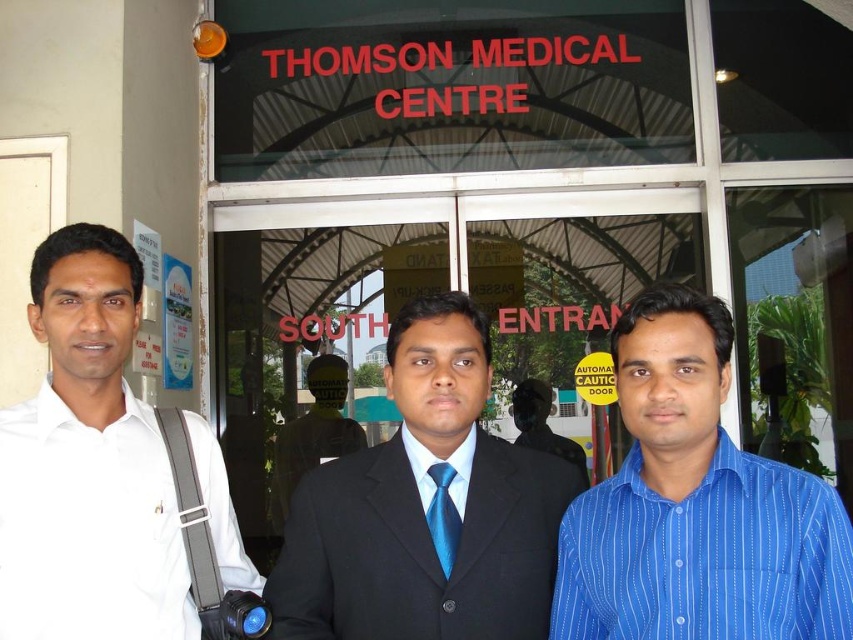
You are standing at the south entrance of Thomson Medical Centre. You see two points marked on the ground. One is at coordinate point (x=564, y=442) and the other at point (x=442, y=525). Which point is closer to the entrance?

Point (x=442, y=525) is closer to the entrance because it is in front of point (x=564, y=442).

Looking at this image, you are a photographer trying to capture a group photo of the blue striped shirt at right and the blue satin tie at center. Since you want to ensure both subjects are in focus, you need to know which one is wider to adjust your camera settings. Can you tell me which object is wider?

The blue striped shirt at right is wider than the blue satin tie at center.

Looking at this image, you are a security guard at Thomson Medical Centre. You need to verify the positions of two items worn by the men in the image. Which item is located higher up on the body between the blue striped shirt at right and the blue satin tie at center?

The blue striped shirt at right is positioned over the blue satin tie at center, meaning it is higher up on the body.